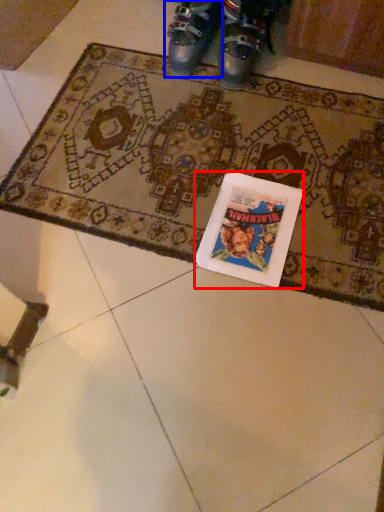
Question: Which of the following is the farthest to the observer, book cover (highlighted by a red box) or footwear (highlighted by a blue box)?

Choices:
 (A) book cover
 (B) footwear

Answer: (B)